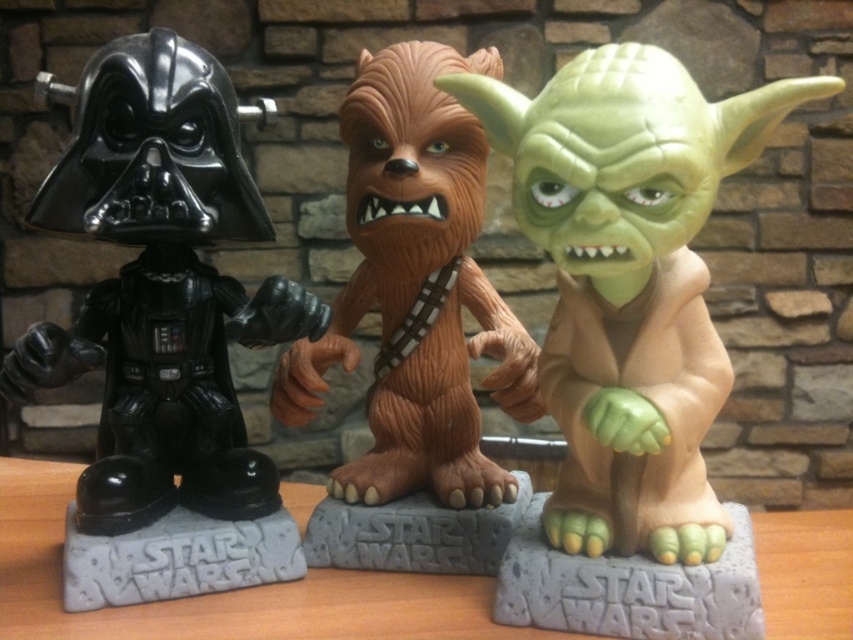
You are trying to fit both the matte black helmet at left and the brown textured fur at center into a rectangular box. Which object should you place first to ensure they both fit?

You should place the matte black helmet at left first since it might be wider than the brown textured fur at center, allowing more space for the narrower object afterward.

You are organizing a Star Wars display and need to ensure that the matte black helmet at left and the green matte yoda at center are spaced appropriately. According to the description, which object should be placed farther back to maintain proper scale?

The matte black helmet at left should be placed farther back because it is larger in size than the green matte yoda at center, ensuring the scale appears balanced from the viewer perspective.